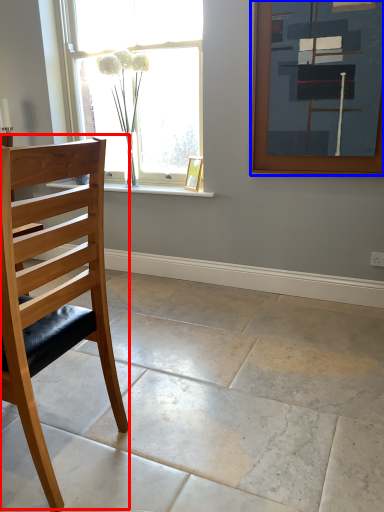
Question: Which point is closer to the camera, chair (highlighted by a red box) or picture frame (highlighted by a blue box)?

Choices:
 (A) chair
 (B) picture frame

Answer: (A)